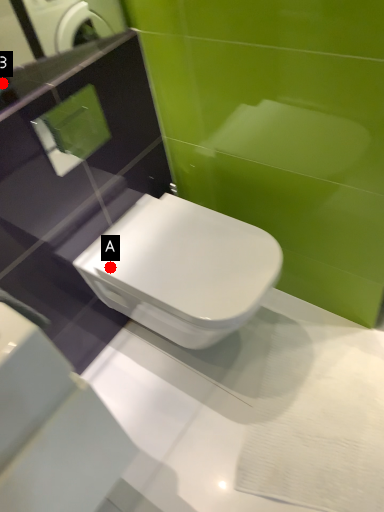
Question: Two points are circled on the image, labeled by A and B beside each circle. Which of the following is the closest to the observer?

Choices:
 (A) A is closer
 (B) B is closer

Answer: (B)